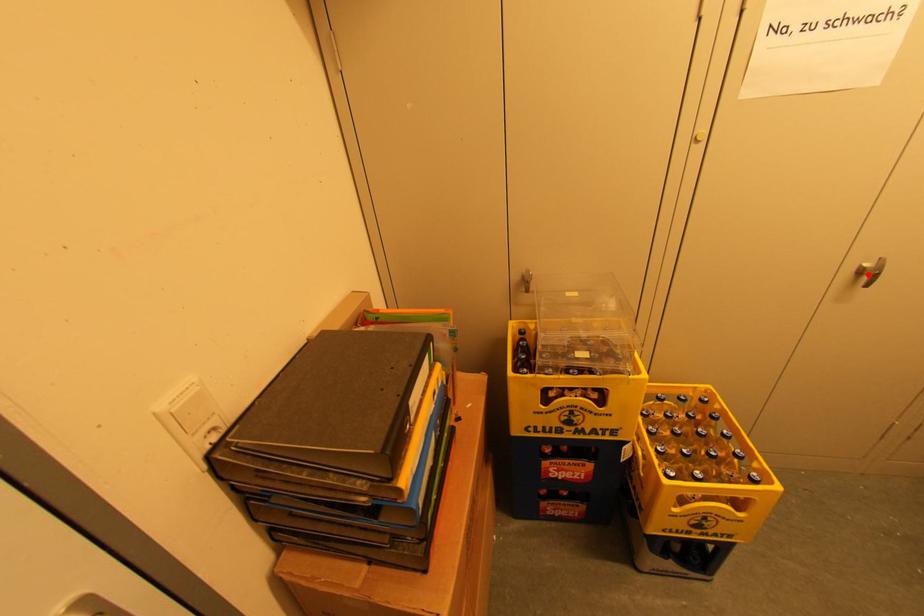
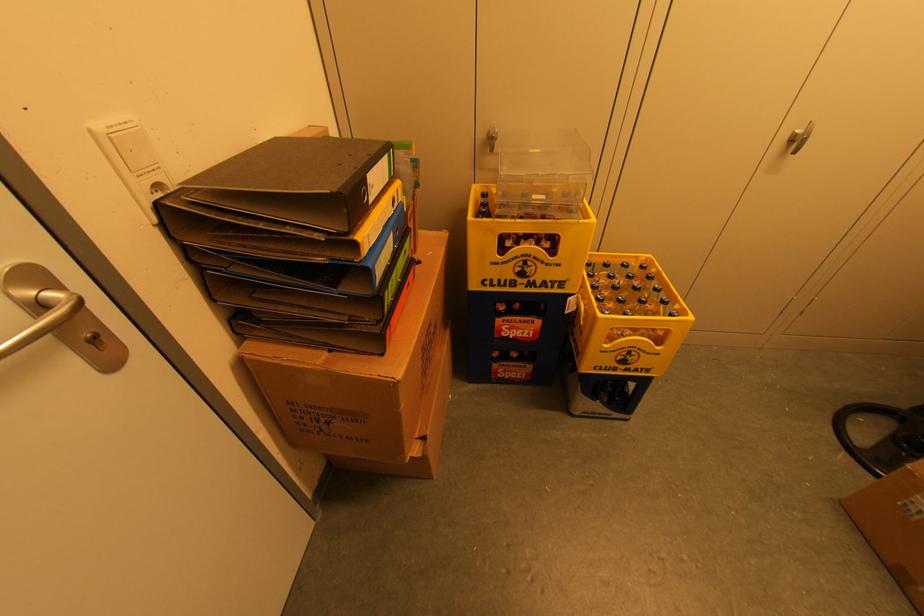
In the second image, find the point that corresponds to the highlighted location in the first image.

(798, 142)